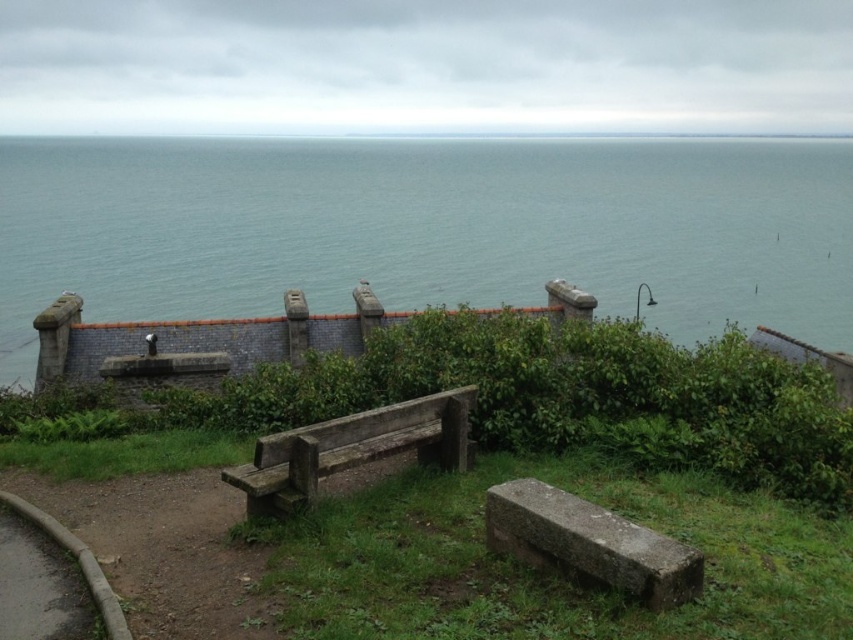
Where is `weathered stone bench at lower right`? This screenshot has height=640, width=853. weathered stone bench at lower right is located at coordinates (589, 544).

This screenshot has width=853, height=640. In order to click on weathered stone bench at lower right in this screenshot , I will do `click(589, 544)`.

Does blue water at upper center have a lesser width compared to weathered wood bench at center?

No.

In the scene shown: Who is more distant from viewer, [519,253] or [376,422]?

The point [519,253] is more distant.

This screenshot has height=640, width=853. Find the location of `blue water at upper center`. blue water at upper center is located at coordinates (426, 228).

Is blue water at upper center bigger than weathered stone bench at lower right?

Yes, blue water at upper center is bigger than weathered stone bench at lower right.

Can you confirm if blue water at upper center is positioned to the right of weathered stone bench at lower right?

No, blue water at upper center is not to the right of weathered stone bench at lower right.

Does point (447, 276) come farther from viewer compared to point (677, 576)?

Yes, point (447, 276) is farther from viewer.

You are a GUI agent. You are given a task and a screenshot of the screen. Output one action in this format:
    pyautogui.click(x=<x>, y=<y>)
    Task: Click on the blue water at upper center
    
    Given the screenshot: What is the action you would take?
    pyautogui.click(x=426, y=228)